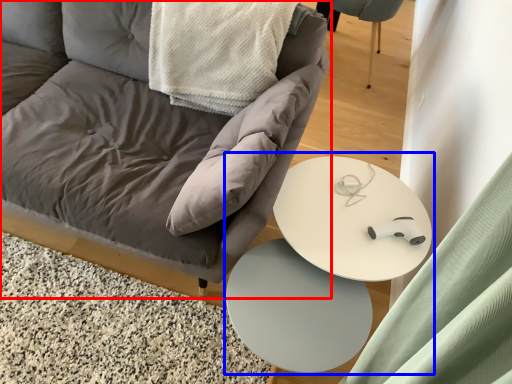
Question: Among these objects, which one is nearest to the camera, chair (highlighted by a red box) or round table (highlighted by a blue box)?

Choices:
 (A) chair
 (B) round table

Answer: (A)